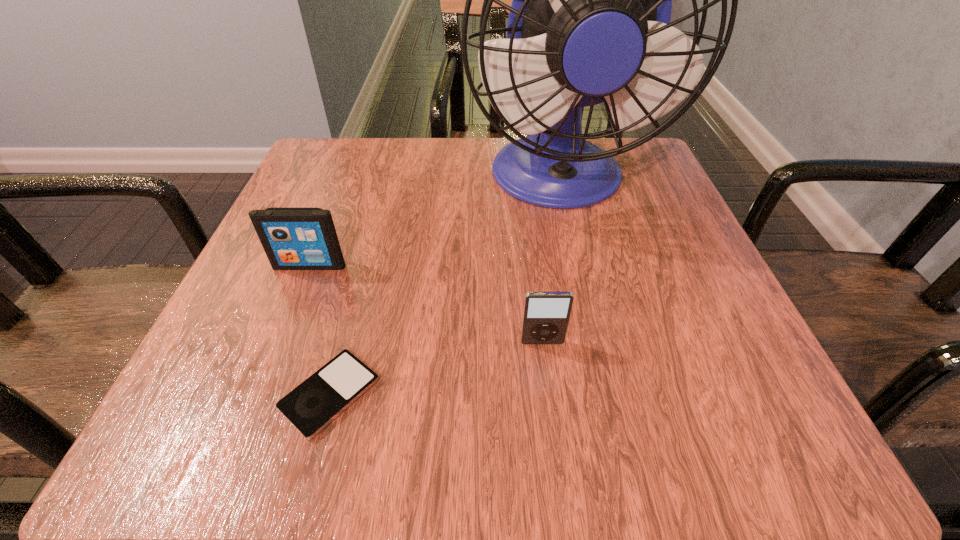
This screenshot has width=960, height=540. I want to click on fan, so click(589, 23).

At what (x,y) coordinates should I click in order to perform the action: click on the tallest object. Please return your answer as a coordinate pair (x, y). This screenshot has width=960, height=540. Looking at the image, I should click on (589, 23).

Where is `the third nearest object`? This screenshot has height=540, width=960. the third nearest object is located at coordinates (293, 238).

Where is `the second nearest iPod`? The height and width of the screenshot is (540, 960). the second nearest iPod is located at coordinates (546, 315).

This screenshot has height=540, width=960. I want to click on the third farthest object, so click(x=546, y=315).

Locate an element on the screen. Image resolution: width=960 pixels, height=540 pixels. the shortest iPod is located at coordinates (316, 402).

Where is `the nearest iPod`? The width and height of the screenshot is (960, 540). the nearest iPod is located at coordinates (316, 402).

At what (x,y) coordinates should I click in order to perform the action: click on free location located 0.220m in front of the tallest object where the airflow is directed. Please return your answer as a coordinate pair (x, y). Looking at the image, I should click on (593, 339).

Find the location of a particular element. free space located 0.140m on the front screen of the third nearest object is located at coordinates (279, 342).

Identify the location of vacant space located 0.140m on the front-facing side of the second nearest iPod. This screenshot has width=960, height=540. (555, 446).